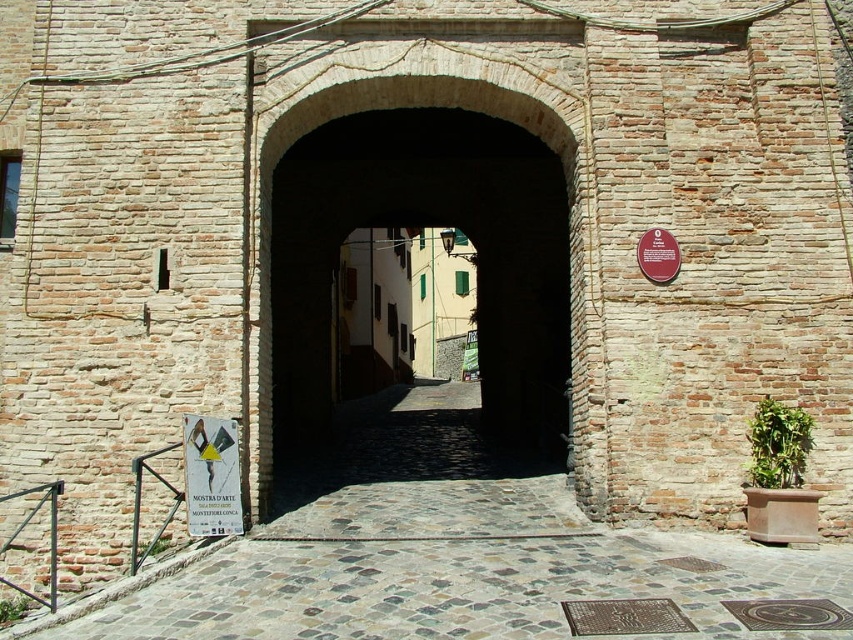
Question: Does smooth stone alley at center appear over brown wooden sign at upper center?

Choices:
 (A) yes
 (B) no

Answer: (B)

Question: Is white paper sign at center below brown wooden sign at upper center?

Choices:
 (A) yes
 (B) no

Answer: (A)

Question: Which point appears farthest from the camera in this image?

Choices:
 (A) (317, 403)
 (B) (233, 490)

Answer: (A)

Question: Estimate the real-world distances between objects in this image. Which object is closer to the white paper sign at center?

Choices:
 (A) brick archway at center
 (B) smooth stone alley at center
 (C) brown wooden sign at upper center

Answer: (B)

Question: Observing the image, what is the correct spatial positioning of smooth stone alley at center in reference to brick archway at center?

Choices:
 (A) above
 (B) below

Answer: (B)

Question: Which object appears closest to the camera in this image?

Choices:
 (A) white paper sign at center
 (B) smooth stone alley at center

Answer: (B)